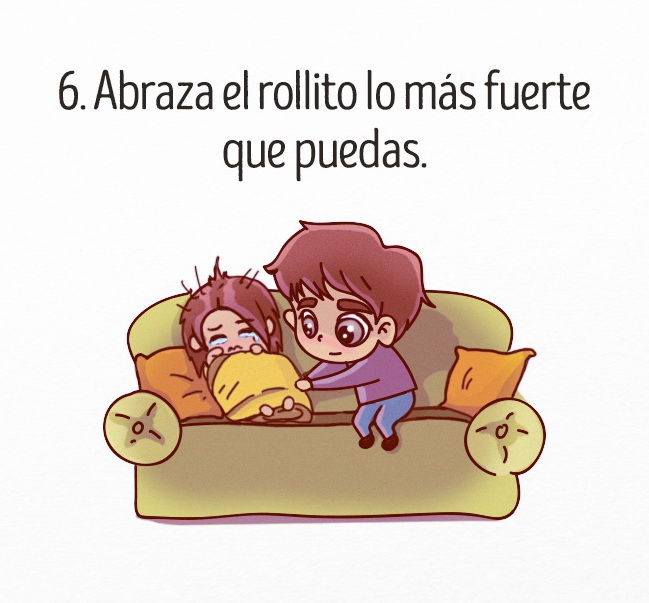
Identify the location of orange pillows. (476, 380), (174, 379).